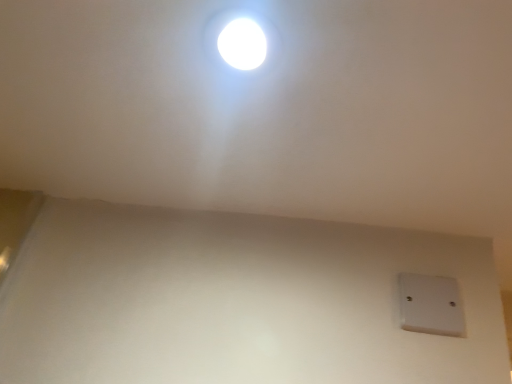
Describe the element at coordinates (431, 305) in the screenshot. I see `white plastic electric outlet at lower right` at that location.

At what (x,y) coordinates should I click in order to perform the action: click on white plastic electric outlet at lower right. Please return your answer as a coordinate pair (x, y). The image size is (512, 384). Looking at the image, I should click on (431, 305).

Find the location of a particular element. white plastic electric outlet at lower right is located at coordinates (431, 305).